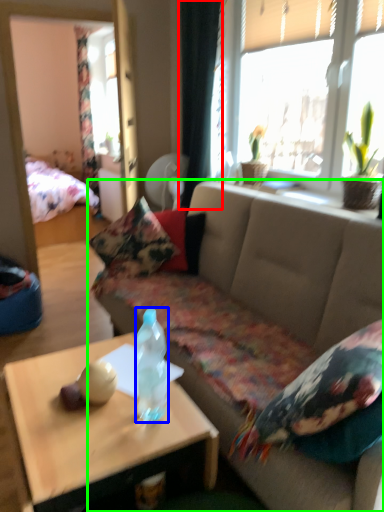
Question: Estimate the real-world distances between objects in this image. Which object is farther from curtain (highlighted by a red box), bottle (highlighted by a blue box) or studio couch (highlighted by a green box)?

Choices:
 (A) bottle
 (B) studio couch

Answer: (A)